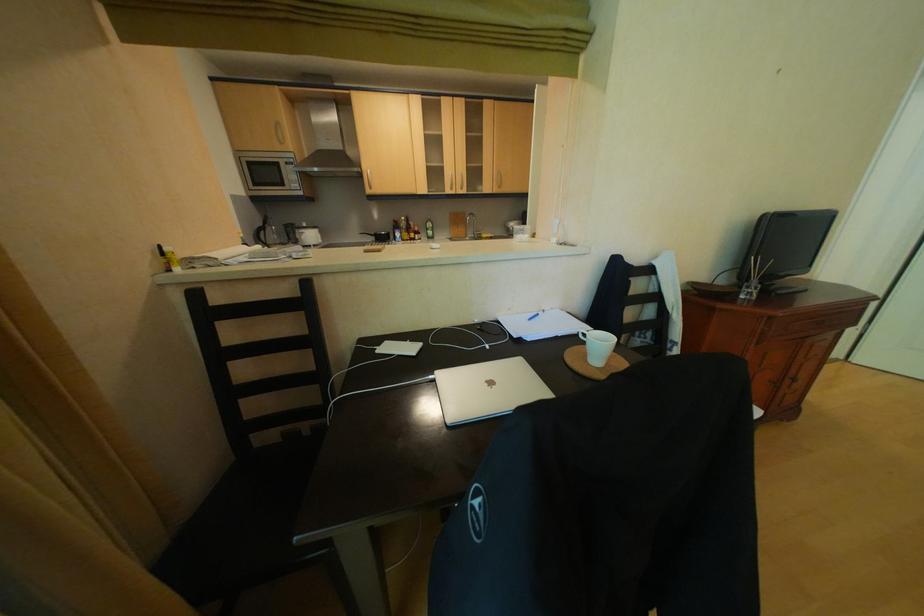
Where would you lift the green bottle? Please return your answer as a coordinate pair (x, y).

(429, 229)